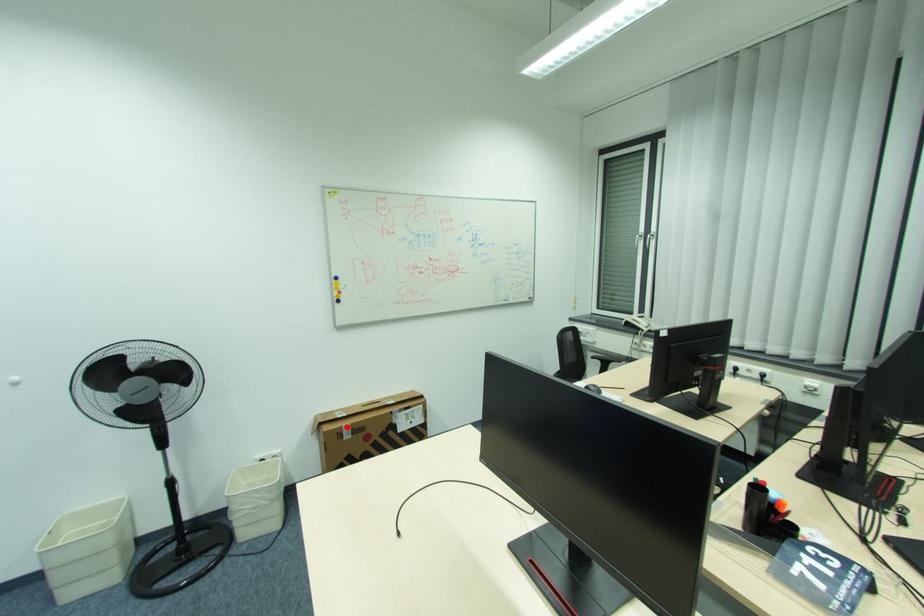
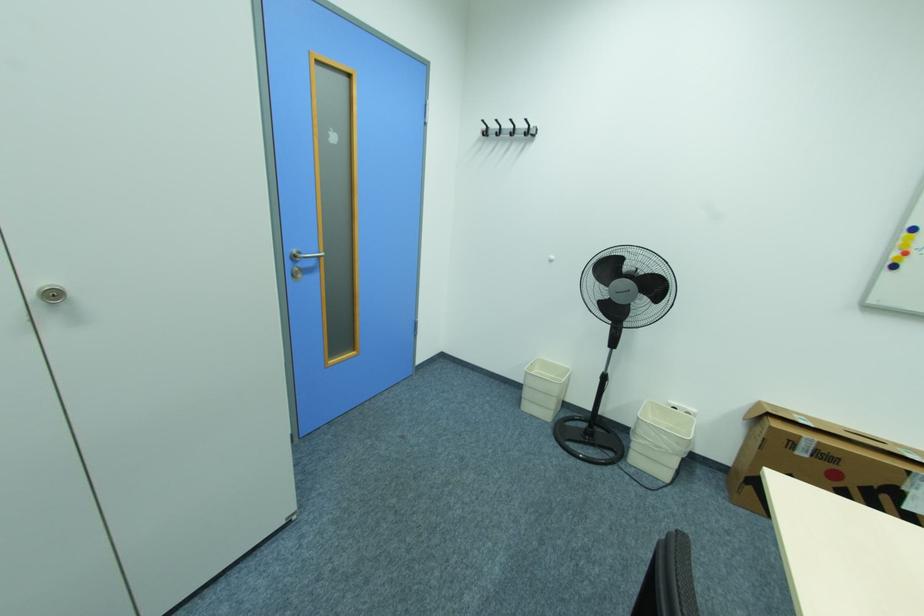
Where in the second image is the point corresponding to the highlighted location from the first image?

(805, 437)